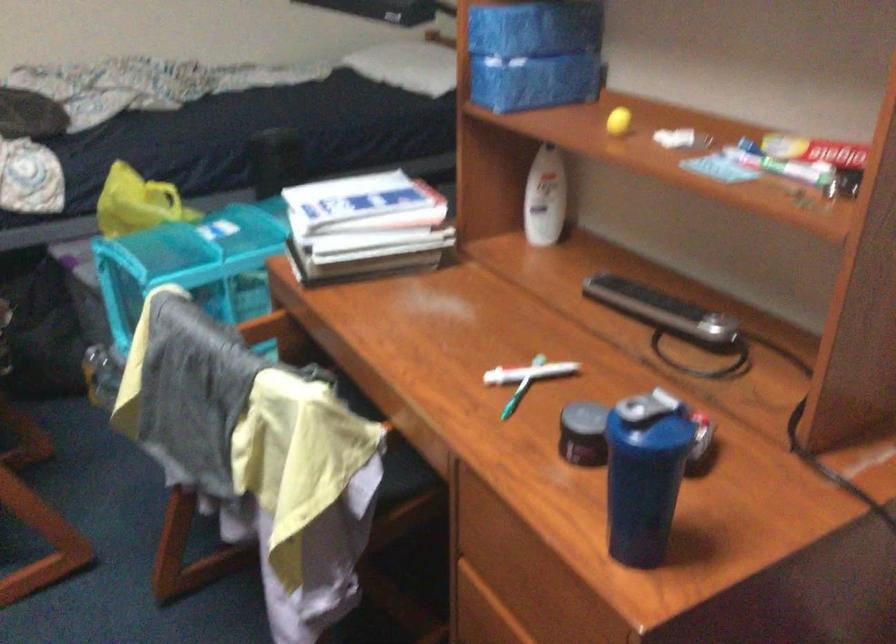
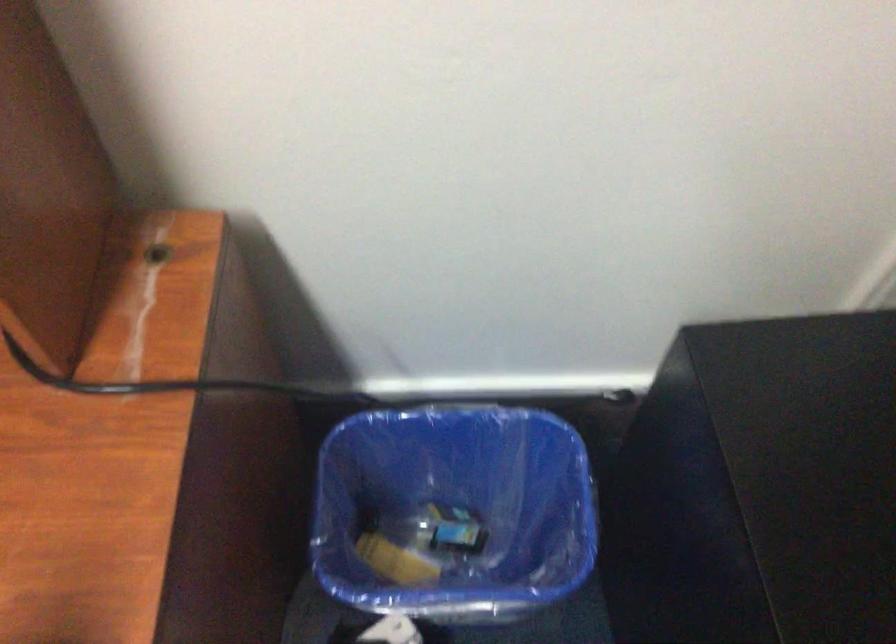
The images are taken continuously from a first-person perspective. In which direction is your viewpoint rotating?

The camera's rotation is toward right-down.